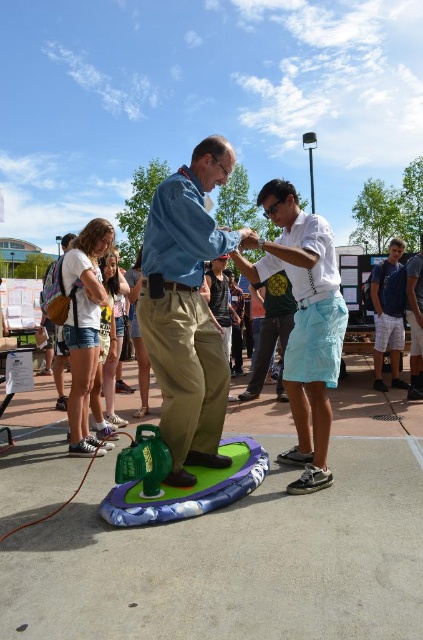
Question: Which point is farther to the camera?

Choices:
 (A) white cotton shirt at center
 (B) green rubber mat at center
 (C) blue denim shirt at center

Answer: (A)

Question: In this image, where is blue denim shirt at center located relative to blue denim shorts at lower right?

Choices:
 (A) left
 (B) right

Answer: (A)

Question: Is green rubber mat at center bigger than blue denim shorts at lower right?

Choices:
 (A) yes
 (B) no

Answer: (B)

Question: Can you confirm if white cotton shirt at center is smaller than blue denim shorts at lower right?

Choices:
 (A) no
 (B) yes

Answer: (A)

Question: Which point is farther from the camera taking this photo?

Choices:
 (A) click(x=310, y=477)
 (B) click(x=230, y=502)
 (C) click(x=404, y=385)

Answer: (C)

Question: Which object appears farthest from the camera in this image?

Choices:
 (A) white cotton shirt at center
 (B) green rubber mat at center

Answer: (A)